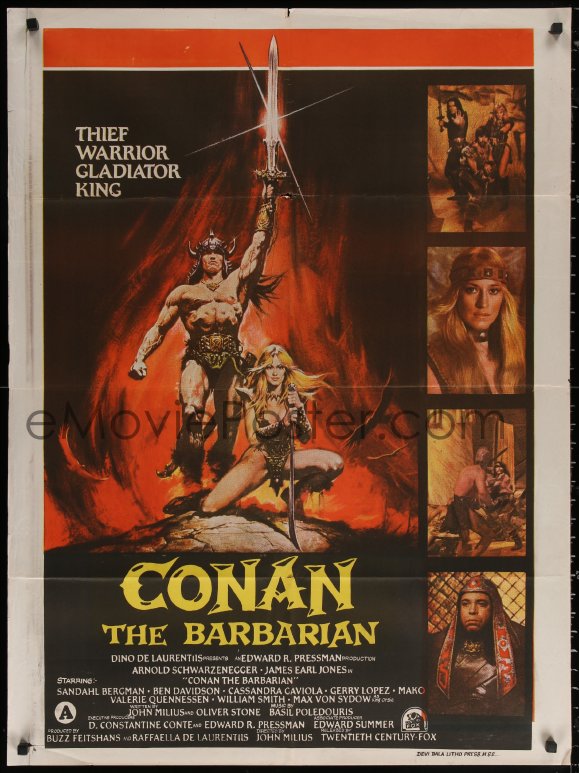
Identify the location of poster tack. (557, 26).